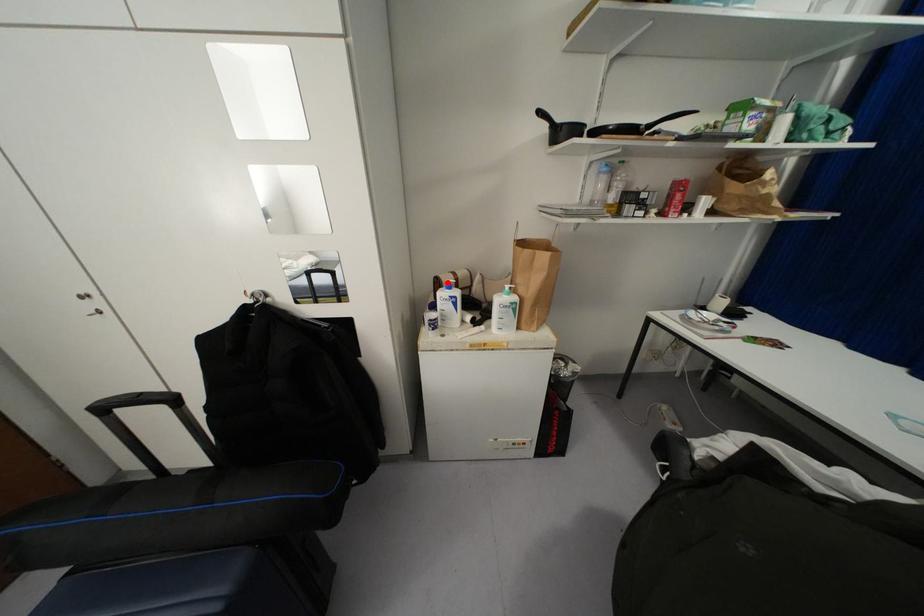
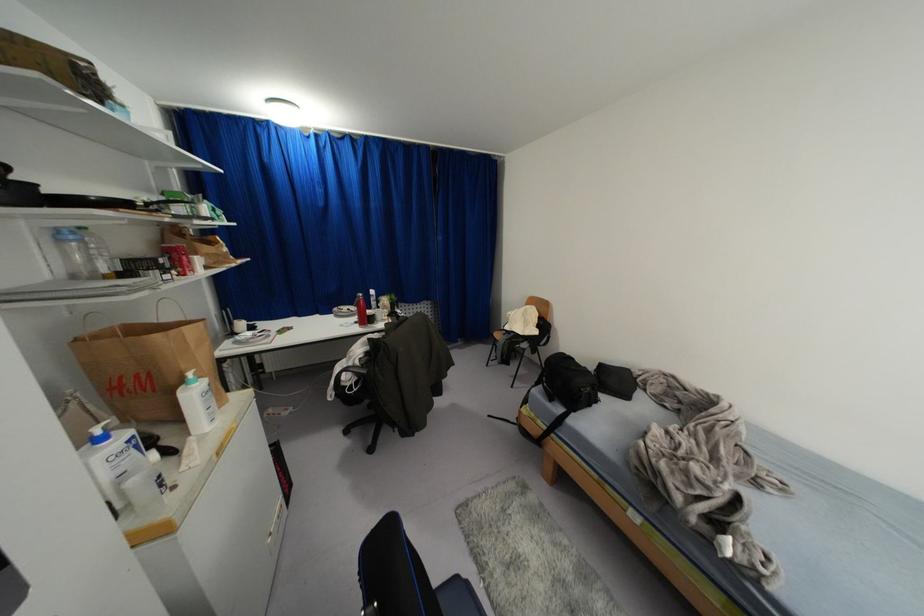
Find the pixel in the second image that matches the highlighted location in the first image.

(98, 431)